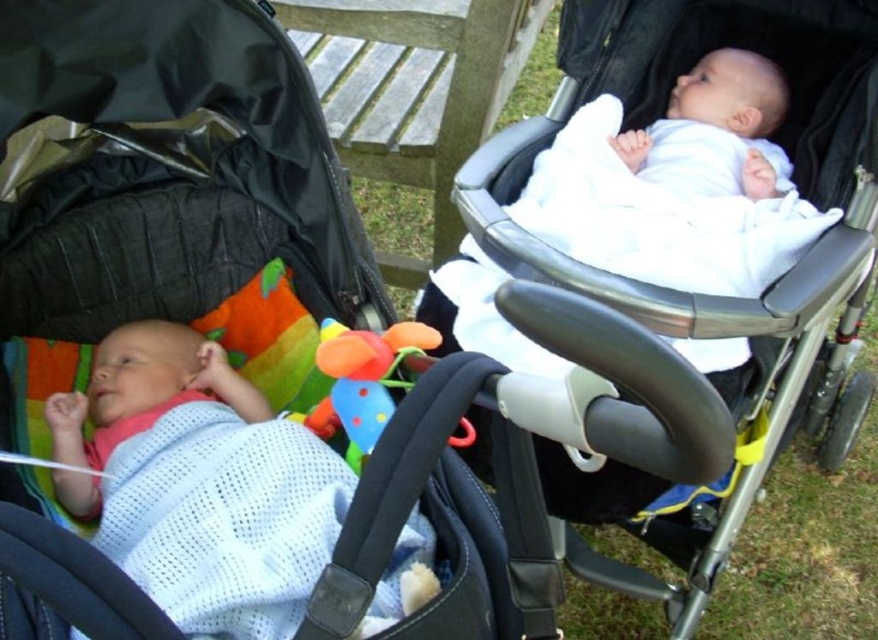
In the scene shown: You are a parent trying to choose between the matte black stroller at left and the white fabric baby carriage at upper center for a trip to the park. Which one is shorter in height?

The matte black stroller at left is not as tall as the white fabric baby carriage at upper center, so the matte black stroller at left is shorter in height.

You are a parent looking for your baby in a park. You see a plastic soft toy at center and a white soft baby at upper right. Which one is located to the right side?

The white soft baby at upper right is located to the right of the plastic soft toy at center.

What is the color of the stroller at the position marked by point (x=168, y=188)?

The stroller at point (x=168, y=188) is matte black.